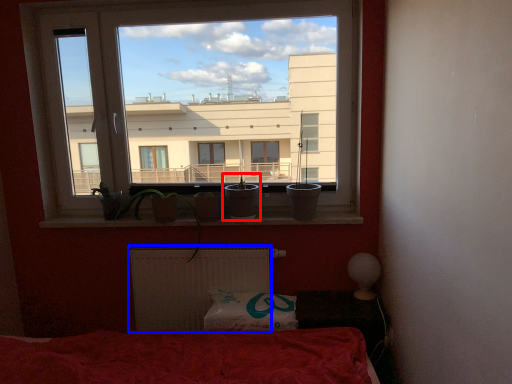
Question: Which object appears farthest to the camera in this image, houseplant (highlighted by a red box) or radiator (highlighted by a blue box)?

Choices:
 (A) houseplant
 (B) radiator

Answer: (B)